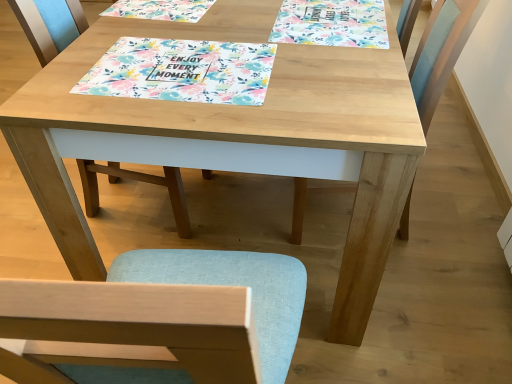
Question: From the image's perspective, is floral paper placemat at center above or below light blue fabric chair at center, the second chair when ordered from right to left?

Choices:
 (A) below
 (B) above

Answer: (B)

Question: Would you say floral paper placemat at center is inside or outside light blue fabric chair at center, the second chair when ordered from right to left?

Choices:
 (A) inside
 (B) outside

Answer: (B)

Question: Estimate the real-world distances between objects in this image. Which object is closer to the light blue fabric chair at center, the first chair in the left-to-right sequence?

Choices:
 (A) light blue fabric chair at right, the 2th chair when ordered from left to right
 (B) floral paper placemat at upper center
 (C) floral paper placemat at center

Answer: (C)

Question: Which object is the farthest from the light blue fabric chair at right, the 2th chair when ordered from left to right?

Choices:
 (A) light blue fabric chair at center, the second chair when ordered from right to left
 (B) floral paper placemat at center
 (C) floral paper placemat at upper center

Answer: (A)